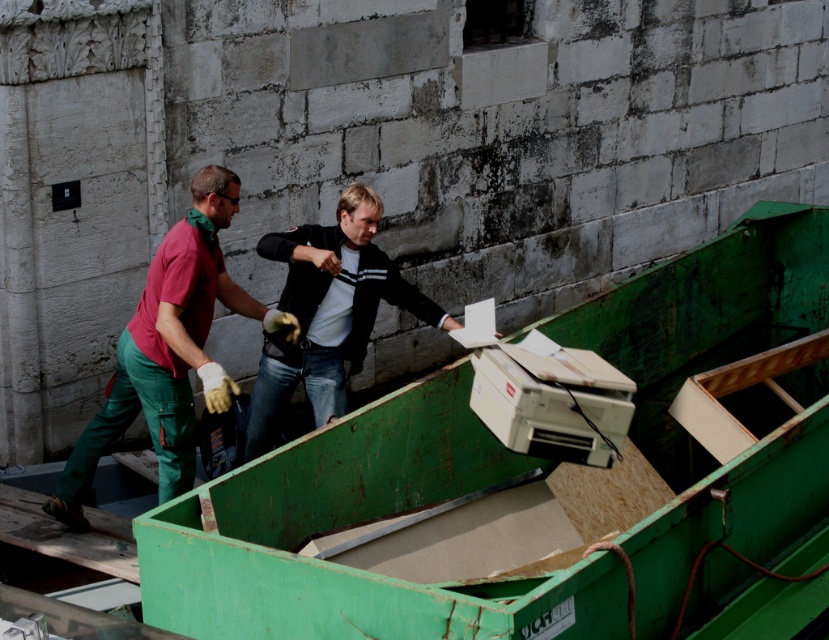
Question: Is matte green jumpsuit at center positioned before black matte jacket at center?

Choices:
 (A) yes
 (B) no

Answer: (A)

Question: Which of the following is the farthest from the observer?

Choices:
 (A) (88, 476)
 (B) (264, 336)

Answer: (B)

Question: Which of the following is the farthest from the observer?

Choices:
 (A) (263, 369)
 (B) (199, 240)

Answer: (A)

Question: Among these points, which one is nearest to the camera?

Choices:
 (A) (347, 294)
 (B) (110, 442)

Answer: (B)

Question: Can you confirm if matte green jumpsuit at center is positioned above black matte jacket at center?

Choices:
 (A) yes
 (B) no

Answer: (B)

Question: Is matte green jumpsuit at center smaller than black matte jacket at center?

Choices:
 (A) no
 (B) yes

Answer: (A)